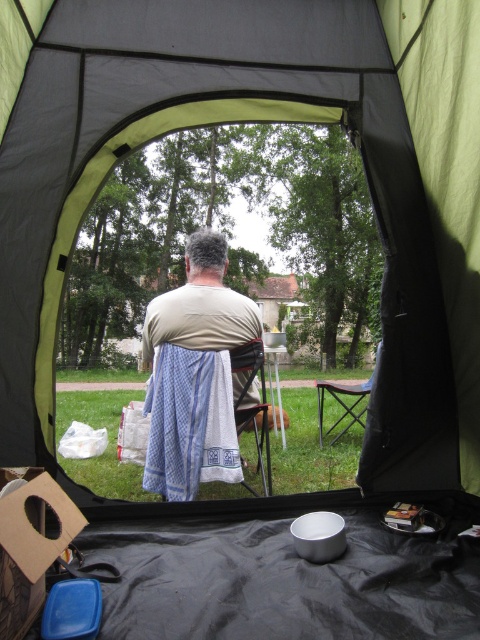
Question: Observing the image, what is the correct spatial positioning of blue checkered apron at center in reference to wooden folding chair at center?

Choices:
 (A) above
 (B) below

Answer: (A)

Question: Which point is farther from the camera taking this photo?

Choices:
 (A) (253, 333)
 (B) (356, 420)

Answer: (B)

Question: Can you confirm if blue checkered apron at center is positioned below wooden folding chair at center?

Choices:
 (A) yes
 (B) no

Answer: (B)

Question: Does blue checkered apron at center appear on the right side of wooden folding chair at center?

Choices:
 (A) no
 (B) yes

Answer: (A)